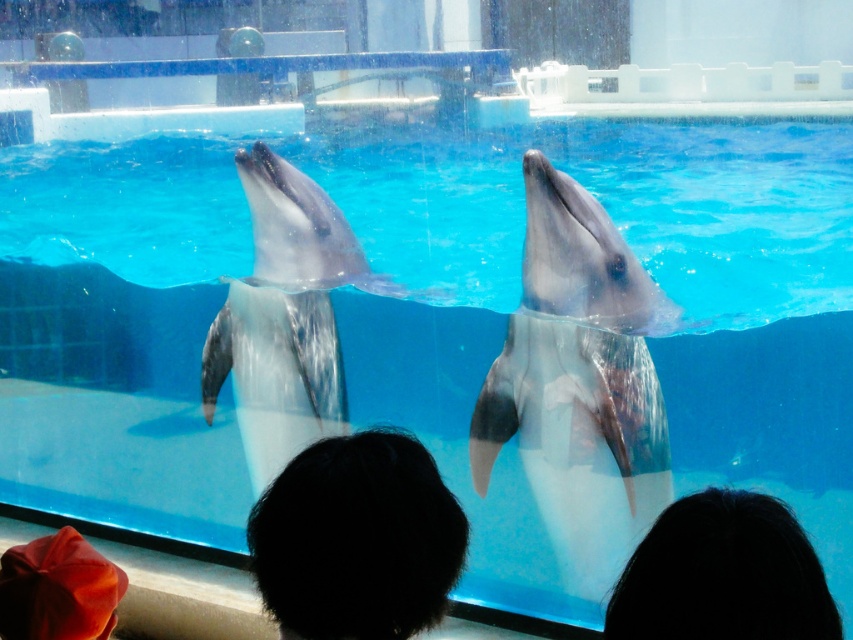
Question: Which of the following is the farthest from the observer?

Choices:
 (A) (102, 589)
 (B) (544, 179)
 (C) (229, 308)
 (D) (837, 616)

Answer: (C)

Question: Can you confirm if gray matte dolphin at center is positioned to the left of smooth gray dolphin at center?

Choices:
 (A) no
 (B) yes

Answer: (A)

Question: Which object is farther from the camera taking this photo?

Choices:
 (A) smooth gray dolphin at center
 (B) black hair at lower center

Answer: (A)

Question: Which of these objects is positioned farthest from the smooth gray dolphin at center?

Choices:
 (A) smooth orange hat at lower left
 (B) gray matte dolphin at center
 (C) black hair at lower center

Answer: (C)

Question: Is the position of gray matte dolphin at center more distant than that of smooth gray dolphin at center?

Choices:
 (A) yes
 (B) no

Answer: (B)

Question: Does black hair at lower center appear on the right side of smooth orange hat at lower left?

Choices:
 (A) yes
 (B) no

Answer: (A)